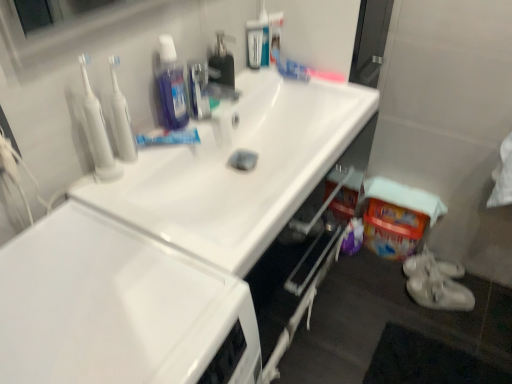
Question: Relative to white fabric towel at lower right, is clear plastic bottle at upper center, positioned as the second cleaning products in right-to-left order, in front or behind?

Choices:
 (A) front
 (B) behind

Answer: (A)

Question: Would you say clear plastic bottle at upper center, positioned as the second cleaning products in right-to-left order, is inside or outside white fabric towel at lower right?

Choices:
 (A) outside
 (B) inside

Answer: (A)

Question: Which object is the farthest from the white plastic toothbrushes at upper left, the first cleanser from the right?

Choices:
 (A) clear plastic bottle at upper center, the third cleaning products when ordered from left to right
 (B) white glossy sink at upper center
 (C) white plastic toothbrushes at upper left, which is the second cleanser from right to left
 (D) translucent purple bottle at upper center, which appears as the fourth cleaning products when viewed from the right
 (E) translucent plastic soap dispenser at center, which appears as the second cleaning products when viewed from the left

Answer: (A)

Question: Which is nearer to the metallic silver faucet at upper center?

Choices:
 (A) white glossy cabinet at lower center
 (B) clear plastic bottle at upper center, positioned as the second cleaning products in right-to-left order
 (C) white glossy sink at upper center
 (D) translucent plastic bottle at upper center, the first cleaning products when ordered from right to left
 (E) translucent plastic soap dispenser at center, which appears as the second cleaning products when viewed from the left

Answer: (E)